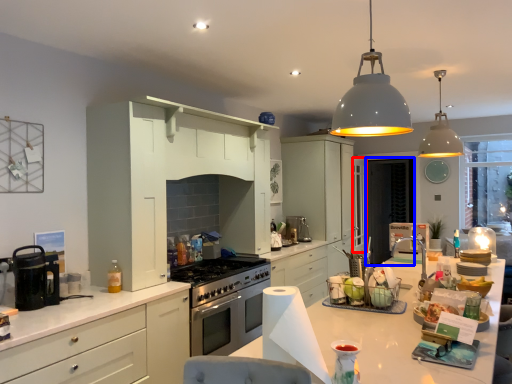
Question: Which point is further to the camera, glass door (highlighted by a red box) or screen door (highlighted by a blue box)?

Choices:
 (A) glass door
 (B) screen door

Answer: (B)